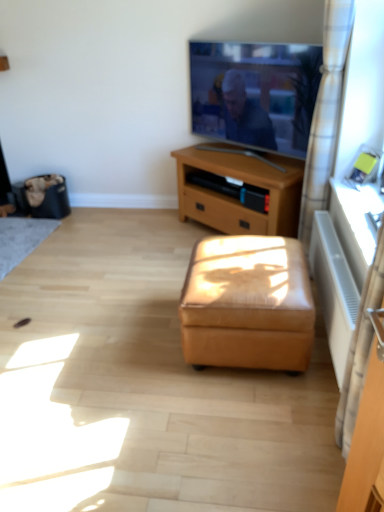
At what (x,y) coordinates should I click in order to perform the action: click on free spot in front of leather ottoman at center. Please return your answer as a coordinate pair (x, y). The width and height of the screenshot is (384, 512). Looking at the image, I should click on (237, 428).